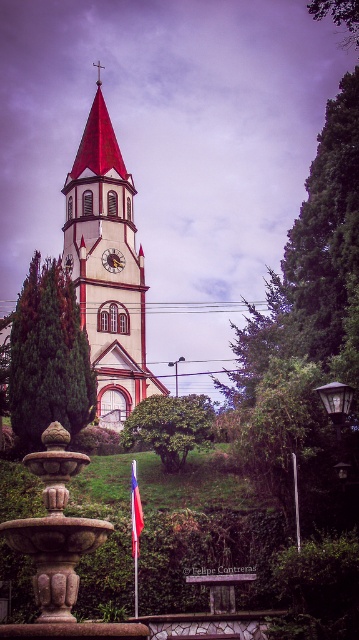
You are standing in front of the church and want to take a photo that includes both the smooth white steeple at center and the gold textured clock at center. Which object should you position to the left side of your camera frame to ensure both are visible?

You should position the smooth white steeple at center to the left side of your camera frame since it is already to the left of the gold textured clock at center, ensuring both objects are captured in the photo.

You are standing in front of the church and want to take a photo of the smooth white steeple at center. If the camera is focused at coordinates 0.422 on the x and 0.295 on the y, will the steeple be centered in your photo?

Yes, the smooth white steeple at center is located exactly at the coordinates (105, 269), so it will be centered in the photo.